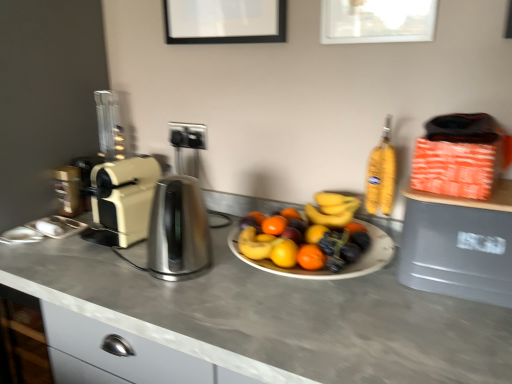
Question: From a real-world perspective, is gray plastic trash can at right positioned over smooth gray countertop at center based on gravity?

Choices:
 (A) yes
 (B) no

Answer: (A)

Question: From the image's perspective, does gray plastic trash can at right appear lower than smooth gray countertop at center?

Choices:
 (A) no
 (B) yes

Answer: (A)

Question: Is gray plastic trash can at right surrounding smooth gray countertop at center?

Choices:
 (A) yes
 (B) no

Answer: (B)

Question: Is gray plastic trash can at right facing away from smooth gray countertop at center?

Choices:
 (A) no
 (B) yes

Answer: (A)

Question: From the image's perspective, would you say gray plastic trash can at right is positioned over smooth gray countertop at center?

Choices:
 (A) no
 (B) yes

Answer: (B)

Question: From the image's perspective, is satin silver kettle at center above or below metallic silver coffee machine at left?

Choices:
 (A) below
 (B) above

Answer: (A)

Question: From a real-world perspective, is satin silver kettle at center physically located above or below metallic silver coffee machine at left?

Choices:
 (A) below
 (B) above

Answer: (B)

Question: Is satin silver kettle at center wider or thinner than metallic silver coffee machine at left?

Choices:
 (A) thin
 (B) wide

Answer: (B)

Question: Considering the positions of satin silver kettle at center and metallic silver coffee machine at left in the image, is satin silver kettle at center taller or shorter than metallic silver coffee machine at left?

Choices:
 (A) short
 (B) tall

Answer: (B)

Question: From the image's perspective, is gray plastic trash can at right located above or below smooth gray countertop at center?

Choices:
 (A) below
 (B) above

Answer: (B)

Question: Does point (470, 223) appear closer or farther from the camera than point (58, 256)?

Choices:
 (A) farther
 (B) closer

Answer: (B)

Question: Relative to smooth gray countertop at center, is gray plastic trash can at right in front or behind?

Choices:
 (A) behind
 (B) front

Answer: (A)

Question: From a real-world perspective, is gray plastic trash can at right above or below smooth gray countertop at center?

Choices:
 (A) below
 (B) above

Answer: (B)

Question: Is beige plastic toaster at left wider or thinner than metallic silver coffee machine at left?

Choices:
 (A) wide
 (B) thin

Answer: (A)

Question: In terms of height, does beige plastic toaster at left look taller or shorter compared to metallic silver coffee machine at left?

Choices:
 (A) tall
 (B) short

Answer: (A)